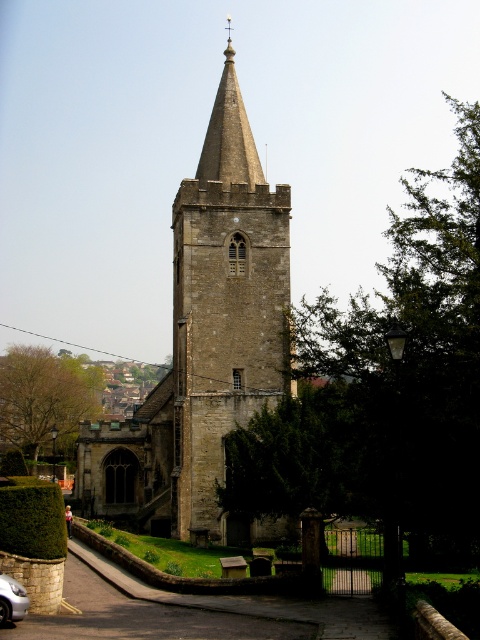
You are an architect examining the historic stone church tower. You notice the stone church steeple at center and the smooth stone spire at center. Which of these two structures is positioned closer to you?

The stone church steeple at center is closer to the viewer than the smooth stone spire at center.

Consider the image. You are standing in front of the historic stone church tower and notice a specific point marked at coordinates (387, 387). Based on the scene description, can you identify what this point is located on?

The point at coordinates (387, 387) is located on the green leafy tree at center.